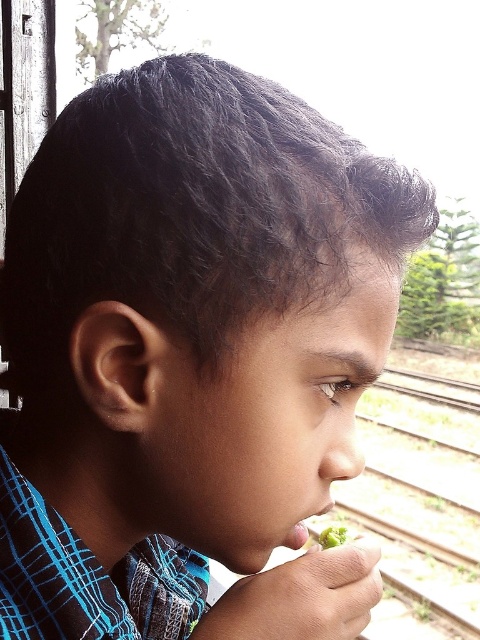
The boy is holding a fork in his left hand. He wants to place both the metal train track at right and the green matte food at mouth on a small shelf that can only hold items up to 10 cm in height. Which item can he place on the shelf?

The green matte food at mouth can be placed on the shelf because the metal train track at right has a greater height and may exceed the 10 cm limit.